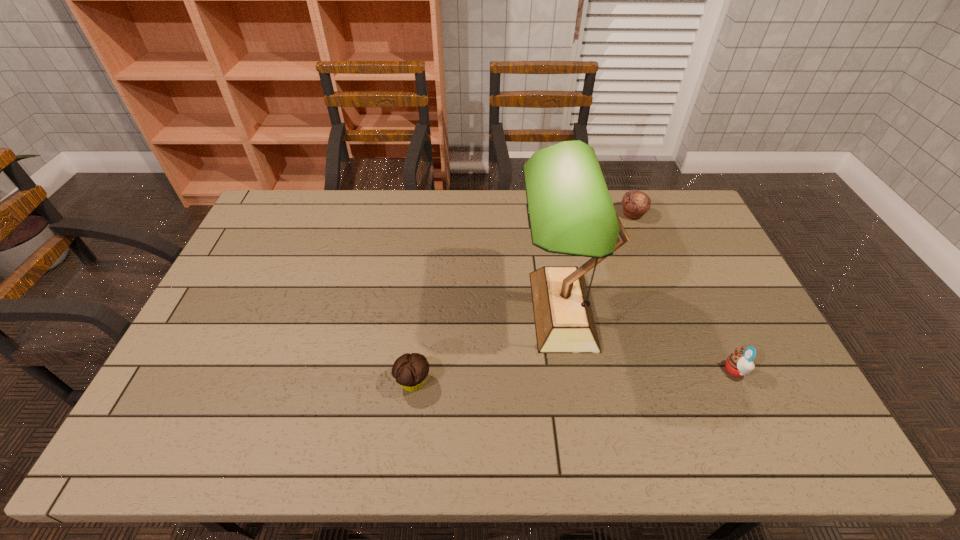
This screenshot has height=540, width=960. I want to click on muffin object that ranks as the closest to the leftmost object, so click(738, 364).

Select which muffin appears as the closest to the leftmost muffin. Please provide its 2D coordinates. Your answer should be formatted as a tuple, i.e. [(x, y)], where the tuple contains the x and y coordinates of a point satisfying the conditions above.

[(738, 364)]

Find the location of a particular element. The height and width of the screenshot is (540, 960). vacant point that satisfies the following two spatial constraints: 1. on the front side of the farthest muffin; 2. on the metallic stand of the third object from right to left is located at coordinates (670, 310).

Where is `vacant area that satisfies the following two spatial constraints: 1. on the front-facing side of the rightmost object; 2. on the front side of the leftmost muffin`? The image size is (960, 540). vacant area that satisfies the following two spatial constraints: 1. on the front-facing side of the rightmost object; 2. on the front side of the leftmost muffin is located at coordinates (741, 382).